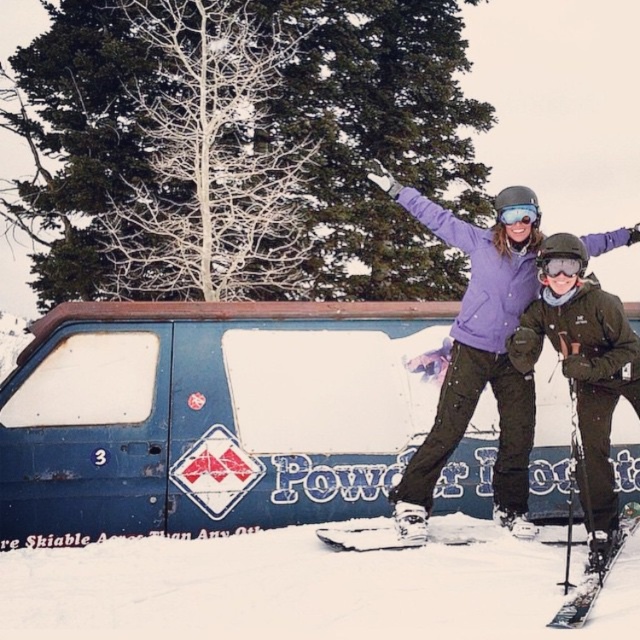
Question: Is shiny black ski at lower right below transparent plastic goggles at center?

Choices:
 (A) yes
 (B) no

Answer: (A)

Question: Among these points, which one is nearest to the camera?

Choices:
 (A) (22, 403)
 (B) (541, 548)
 (C) (499, 209)

Answer: (B)

Question: Which of these objects is positioned closest to the white snow at lower center?

Choices:
 (A) matte purple jacket at center
 (B) blue matte van at center

Answer: (B)

Question: Is shiny black ski at lower right to the left of matte black goggles at upper center from the viewer's perspective?

Choices:
 (A) yes
 (B) no

Answer: (B)

Question: Which of the following is the closest to the observer?

Choices:
 (A) (614, 548)
 (B) (572, 253)
 (C) (328, 304)
 (D) (522, 259)

Answer: (B)

Question: Can you confirm if blue matte van at center is smaller than matte purple jacket at center?

Choices:
 (A) yes
 (B) no

Answer: (B)